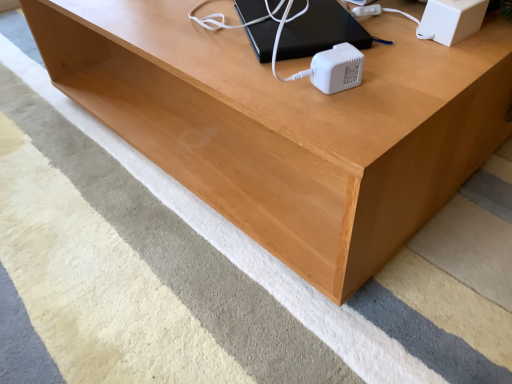
You are a GUI agent. You are given a task and a screenshot of the screen. Output one action in this format:
    pyautogui.click(x=<x>, y=<y>)
    Task: Click on the free space in front of black plastic computer at upper center
    The image size is (512, 384).
    Given the screenshot: What is the action you would take?
    pyautogui.click(x=323, y=83)